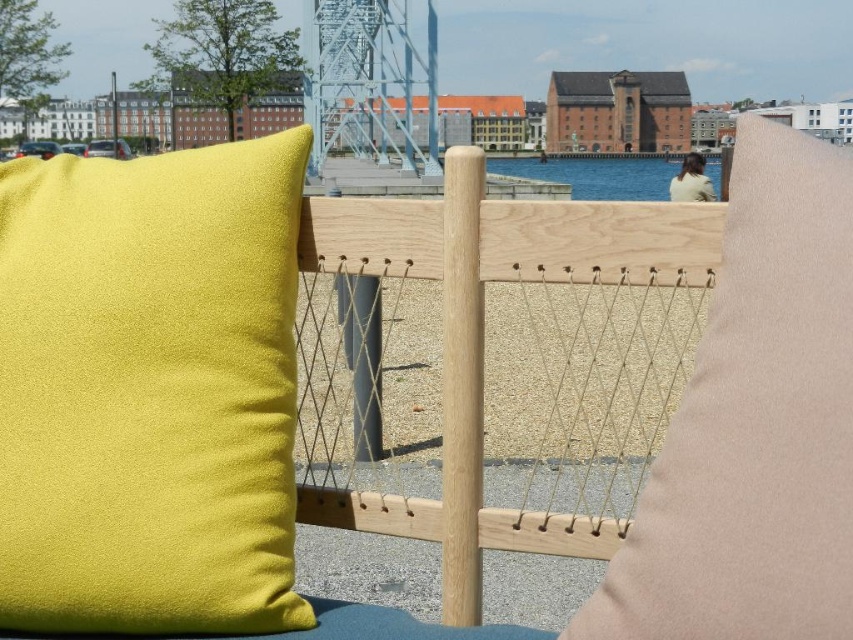
Question: Is natural wood fence at center wider than blue water at center?

Choices:
 (A) no
 (B) yes

Answer: (A)

Question: Which object is the closest to the natural wood fence at center?

Choices:
 (A) blue water at center
 (B) lime green fabric pillow at left

Answer: (B)

Question: Among these objects, which one is farthest from the camera?

Choices:
 (A) natural wood fence at center
 (B) lime green fabric pillow at left

Answer: (B)

Question: Can you confirm if lime green fabric pillow at left is positioned below blue water at center?

Choices:
 (A) yes
 (B) no

Answer: (A)

Question: Which object is farther from the camera taking this photo?

Choices:
 (A) blue water at center
 (B) natural wood fence at center

Answer: (A)

Question: Does natural wood fence at center lie behind blue water at center?

Choices:
 (A) yes
 (B) no

Answer: (B)